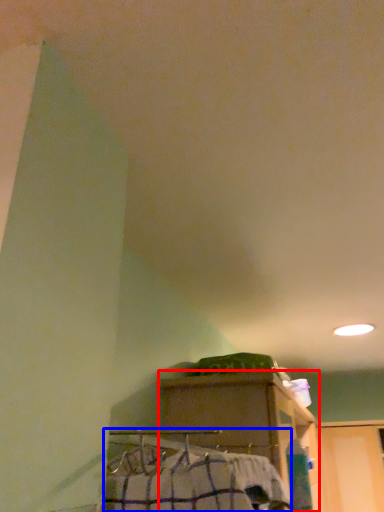
Question: Which of the following is the farthest to the observer, furniture (highlighted by a red box) or job (highlighted by a blue box)?

Choices:
 (A) furniture
 (B) job

Answer: (A)